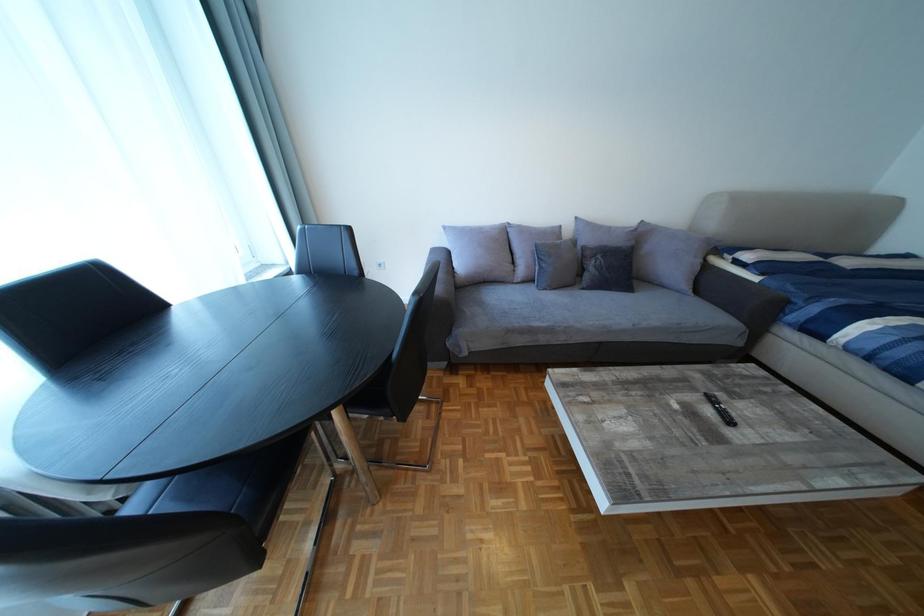
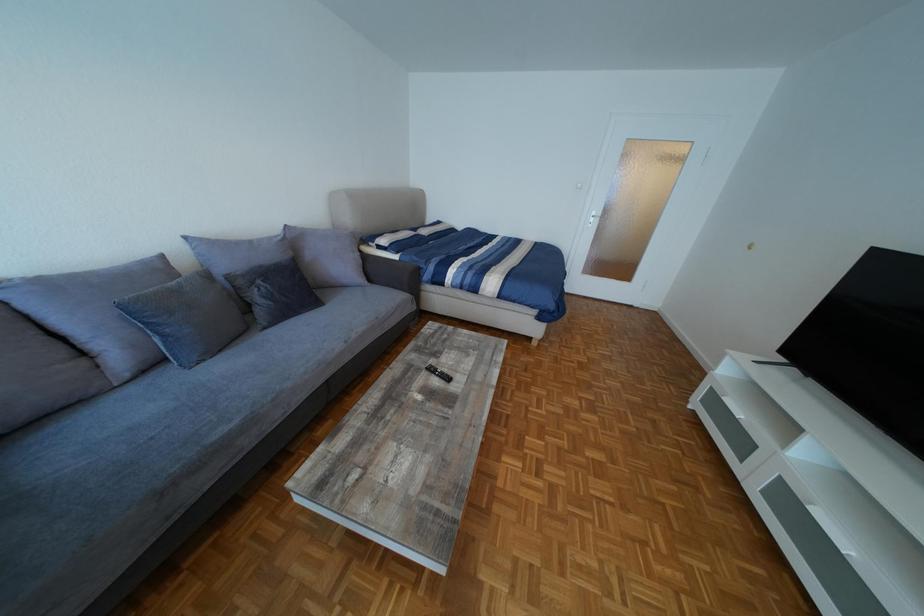
How did the camera likely rotate?

The camera's rotation is toward right-down.